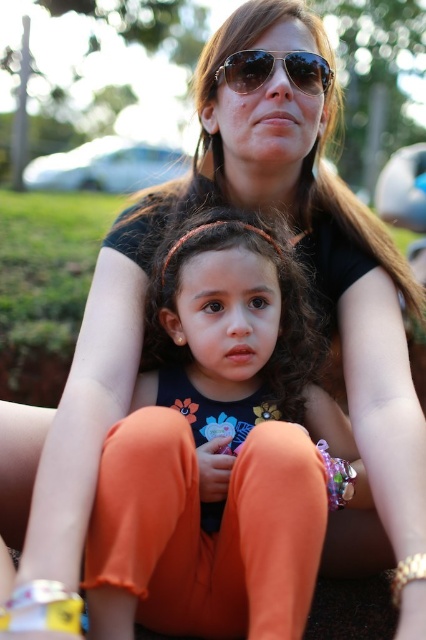
Question: Which point is farther from the camera taking this photo?

Choices:
 (A) (233, 60)
 (B) (206, 326)
 (C) (394, 602)
 (D) (0, 620)

Answer: (C)

Question: Does white fabric bracelet at lower left appear under metallic gold bracelet at lower right?

Choices:
 (A) no
 (B) yes

Answer: (A)

Question: In this image, where is metallic aviator sunglasses at center located relative to white fabric bracelet at lower left?

Choices:
 (A) left
 (B) right

Answer: (B)

Question: Can you confirm if white fabric bracelet at lower left is positioned to the right of metallic gold bracelet at lower right?

Choices:
 (A) yes
 (B) no

Answer: (B)

Question: Which of these objects is positioned farthest from the white fabric bracelet at lower left?

Choices:
 (A) metallic aviator sunglasses at center
 (B) metallic gold bracelet at lower right
 (C) orange fabric pants at center

Answer: (A)

Question: Which object is positioned closest to the metallic gold bracelet at lower right?

Choices:
 (A) white fabric bracelet at lower left
 (B) orange fabric pants at center

Answer: (B)